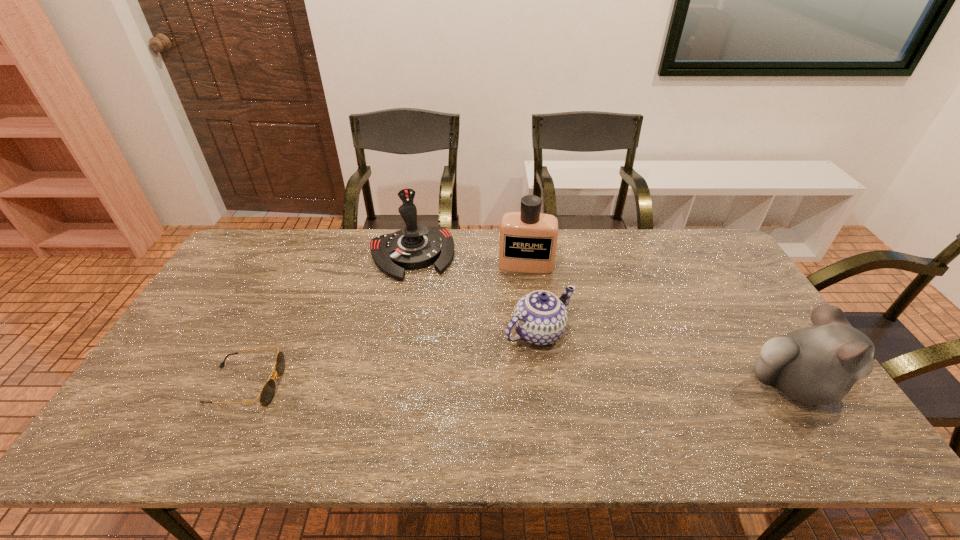
The height and width of the screenshot is (540, 960). Find the location of `hamster located at the near edge`. hamster located at the near edge is located at coordinates (818, 365).

Where is `object present at the left edge`? The image size is (960, 540). object present at the left edge is located at coordinates (267, 393).

This screenshot has height=540, width=960. In order to click on object that is at the right edge in this screenshot , I will do `click(818, 365)`.

Where is `object that is at the near left corner`? The image size is (960, 540). object that is at the near left corner is located at coordinates (267, 393).

Where is `object positioned at the near right corner`? This screenshot has width=960, height=540. object positioned at the near right corner is located at coordinates (818, 365).

This screenshot has width=960, height=540. Identify the location of vacant space at the far edge of the desktop. (610, 272).

In order to click on vacant space at the near edge in this screenshot , I will do `click(393, 406)`.

This screenshot has width=960, height=540. In order to click on vacant space at the left edge of the desktop in this screenshot , I will do `click(265, 280)`.

I want to click on free space at the right edge, so click(730, 342).

In the image, there is a desktop. At what (x,y) coordinates should I click in order to perform the action: click on vacant region at the far left corner. Please return your answer as a coordinate pair (x, y). Looking at the image, I should click on (260, 237).